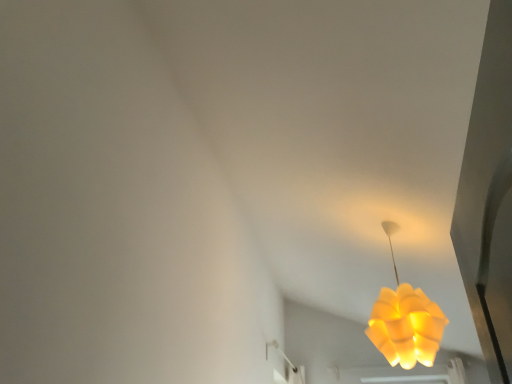
This screenshot has height=384, width=512. I want to click on illuminated paper lantern at upper right, so click(x=405, y=321).

Describe the element at coordinates (405, 321) in the screenshot. The width and height of the screenshot is (512, 384). I see `illuminated paper lantern at upper right` at that location.

Identify the location of illuminated paper lantern at upper right. (405, 321).